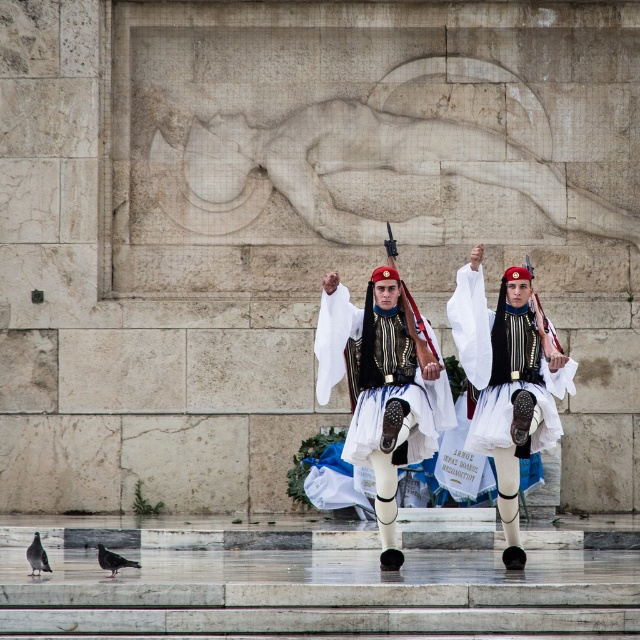
You are an artist sketching the scene and want to ensure the proportions are accurate. Which object should you draw first, the white satin uniform at center or the gray feathered pigeon at lower left, based on their sizes?

The white satin uniform at center should be drawn first because it is larger than the gray feathered pigeon at lower left, ensuring proper scaling in your sketch.